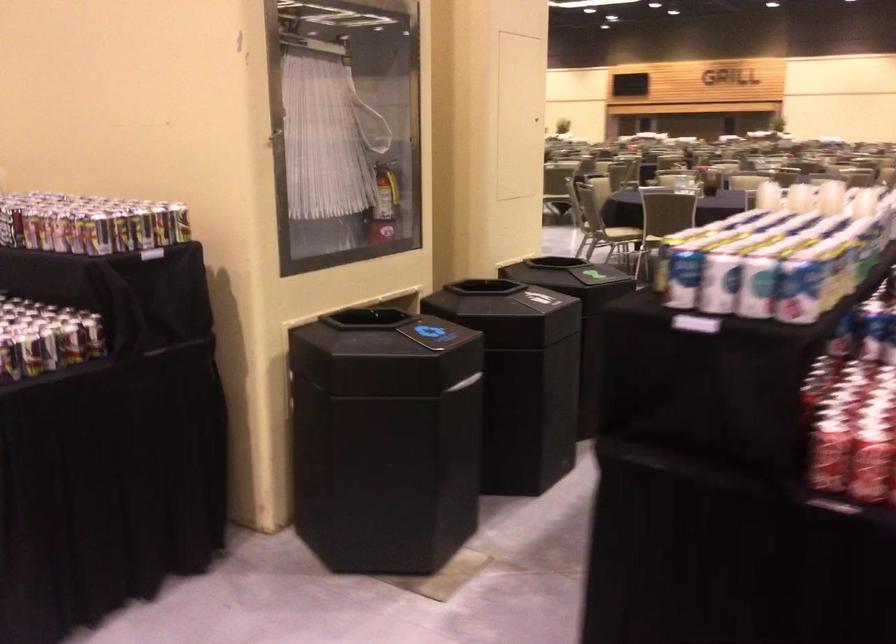
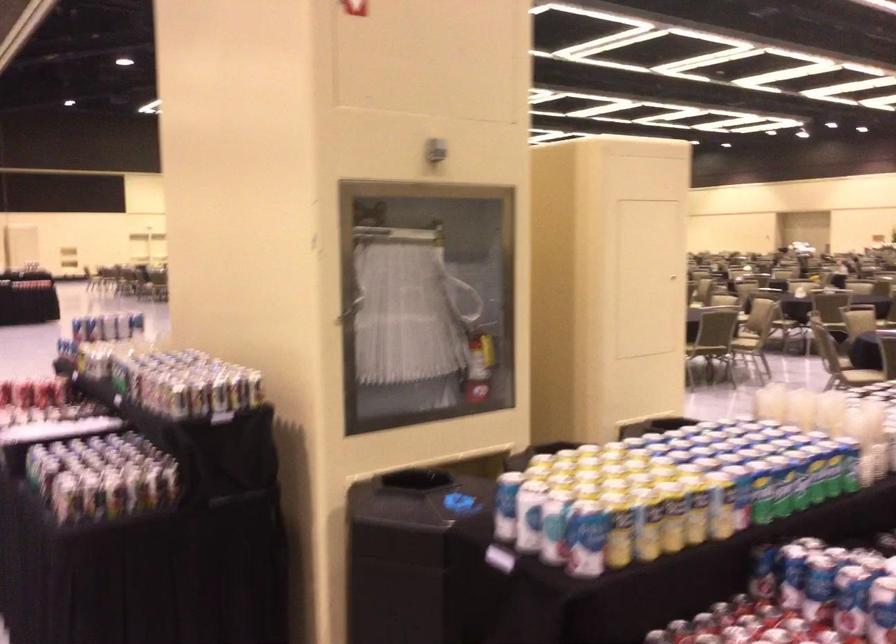
Question: The camera is either moving clockwise (left) or counter-clockwise (right) around the object. The first image is from the beginning of the video and the second image is from the end. Is the camera moving left or right when shooting the video?

Choices:
 (A) Left
 (B) Right

Answer: (B)